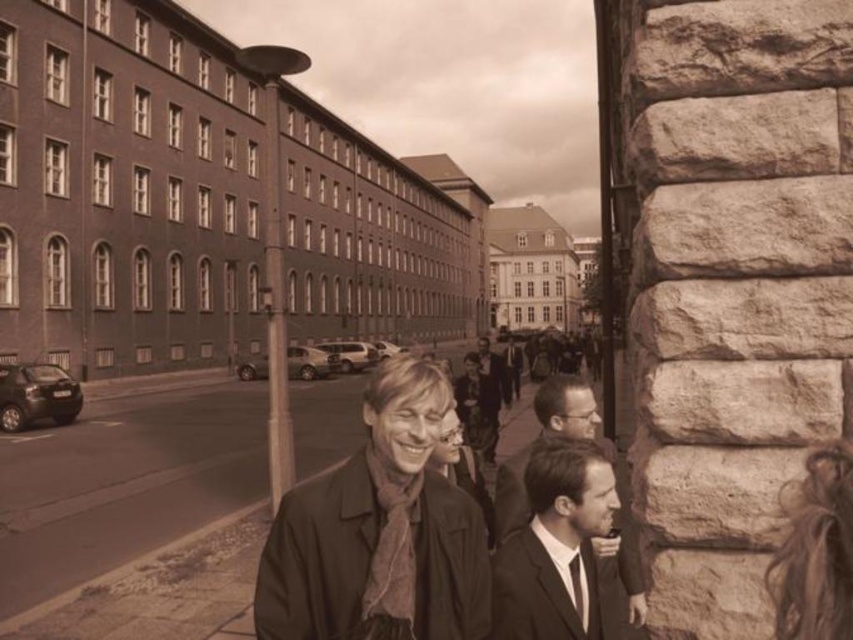
You are a person standing at the point marked as point (379, 532). Looking around, what object is located exactly at your current position?

The dark brown leather jacket at center is located exactly at point (379, 532).

Looking at this image, you are a photographer standing in the middle of the street. You see a smooth black suit at center and a silky black tie at lower center. Which object is taller?

The smooth black suit at center is much taller than the silky black tie at lower center.